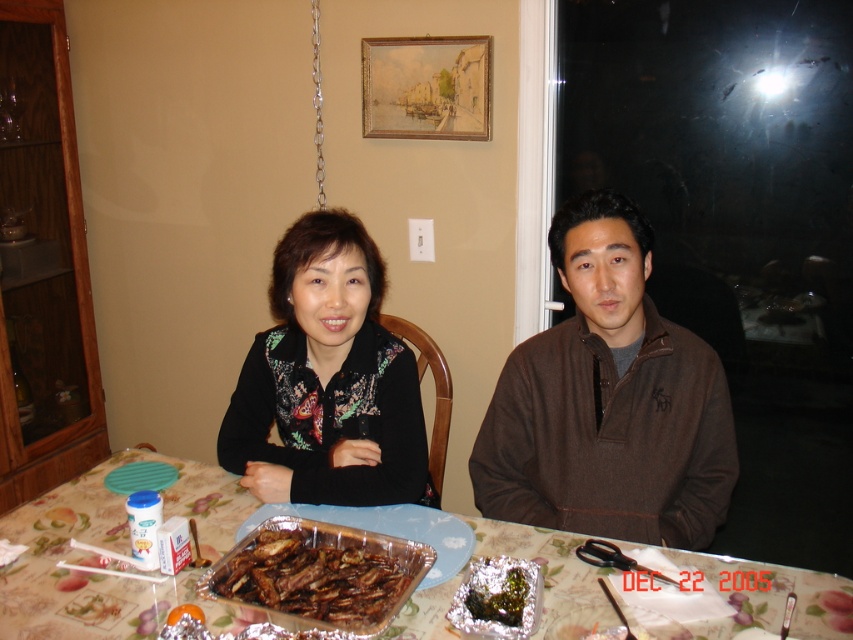
Is point (286, 516) positioned in front of point (518, 620)?

No, (286, 516) is further to viewer.

This screenshot has height=640, width=853. What do you see at coordinates (318, 573) in the screenshot?
I see `brown glazed ribs at center` at bounding box center [318, 573].

Locate an element on the screen. The image size is (853, 640). brown glazed ribs at center is located at coordinates (318, 573).

Which is above, brown fleece jacket at center or brown glazed ribs at center?

brown fleece jacket at center is higher up.

Does brown fleece jacket at center appear on the right side of brown glazed ribs at center?

Correct, you'll find brown fleece jacket at center to the right of brown glazed ribs at center.

At what (x,y) coordinates should I click in order to perform the action: click on brown fleece jacket at center. Please return your answer as a coordinate pair (x, y). Looking at the image, I should click on (608, 401).

Is patterned fabric tablecloth at center positioned behind shiny aluminum tray at center?

No.

Does point (80, 627) come closer to viewer compared to point (329, 509)?

Yes, point (80, 627) is in front of point (329, 509).

Who is more forward, (729, 570) or (421, 540)?

Point (729, 570)

Image resolution: width=853 pixels, height=640 pixels. I want to click on patterned fabric tablecloth at center, so click(x=111, y=548).